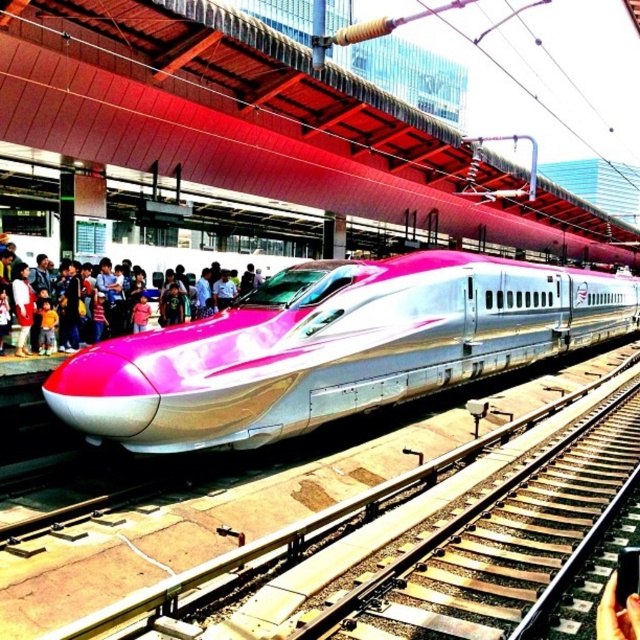
Which is below, pink metallic train at center or pink glossy train at center?

Positioned lower is pink metallic train at center.

Is the position of pink metallic train at center less distant than that of pink glossy train at center?

Yes, pink metallic train at center is in front of pink glossy train at center.

Is point (177, 440) farther from camera compared to point (273, 266)?

That is False.

The height and width of the screenshot is (640, 640). What are the coordinates of `pink metallic train at center` in the screenshot? It's located at (336, 349).